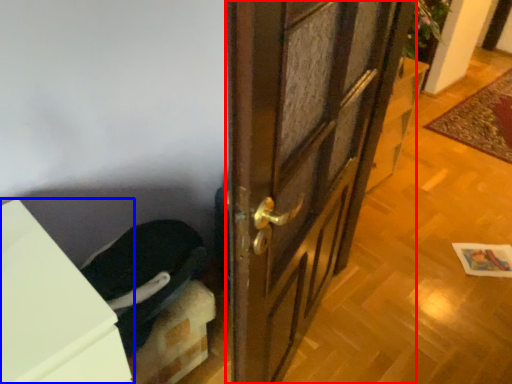
Question: Which point is further to the camera, door (highlighted by a red box) or cabinetry (highlighted by a blue box)?

Choices:
 (A) door
 (B) cabinetry

Answer: (A)